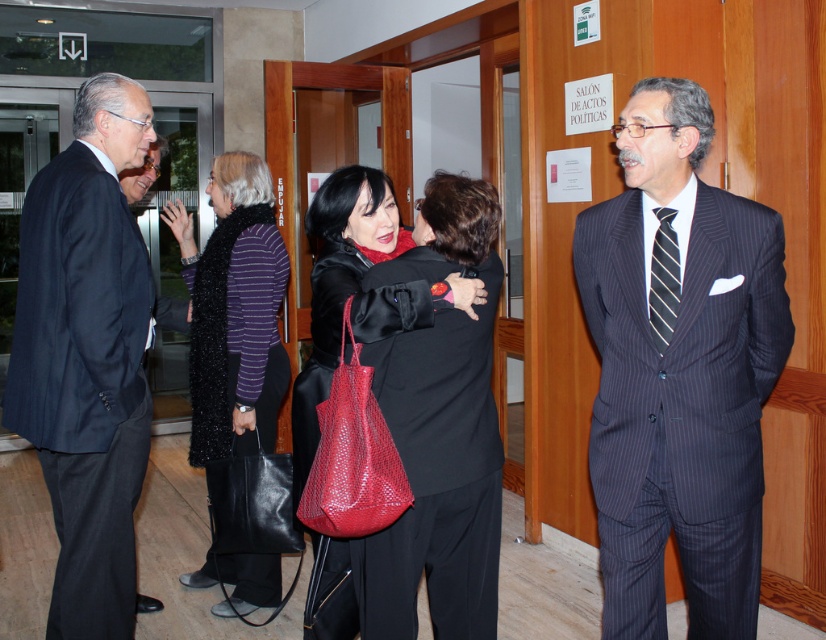
Question: Does dark pinstripe suit at right have a lesser width compared to black striped tie at right?

Choices:
 (A) no
 (B) yes

Answer: (A)

Question: Which point is farther to the camera?

Choices:
 (A) dark blue suit at left
 (B) black striped tie at right
 (C) dark pinstripe suit at right

Answer: (A)

Question: Which object is closer to the camera taking this photo?

Choices:
 (A) dark blue suit at left
 (B) black striped tie at right

Answer: (B)

Question: Does dark pinstripe suit at right come in front of striped wool sweater at center?

Choices:
 (A) yes
 (B) no

Answer: (A)

Question: From the image, what is the correct spatial relationship of dark pinstripe suit at right in relation to matte black coat at center?

Choices:
 (A) right
 (B) left

Answer: (A)

Question: Which point is closer to the camera taking this photo?

Choices:
 (A) (701, 90)
 (B) (665, 234)

Answer: (A)